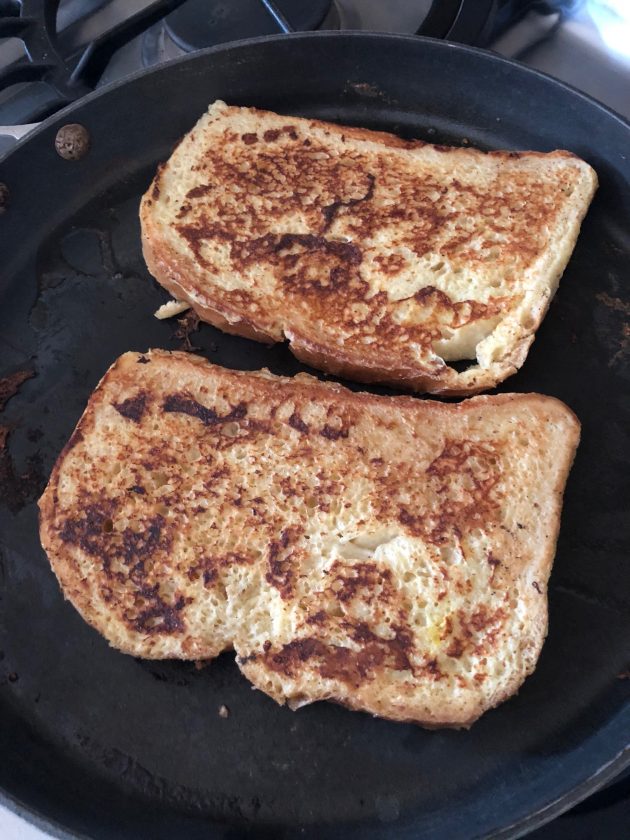
At what (x,y) coordinates should I click in order to perform the action: click on stove top burner. Please return your answer as a coordinate pair (x, y). Image resolution: width=630 pixels, height=840 pixels. Looking at the image, I should click on pos(218,24).